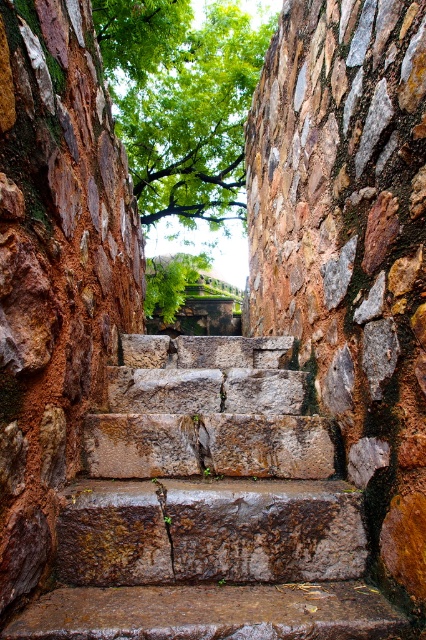
Locate an element on the screen. This screenshot has width=426, height=640. rusty stone stairs at center is located at coordinates (209, 508).

Who is lower down, rusty stone stairs at center or green leafy tree at upper center?

rusty stone stairs at center is below.

At what (x,y) coordinates should I click in order to perform the action: click on rusty stone stairs at center. Please return your answer as a coordinate pair (x, y). The height and width of the screenshot is (640, 426). Looking at the image, I should click on (209, 508).